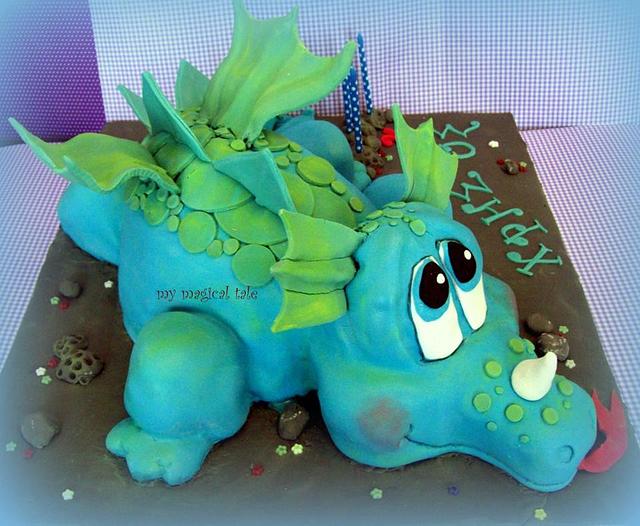
Where is `mat`? This screenshot has width=640, height=526. mat is located at coordinates pyautogui.click(x=546, y=251).